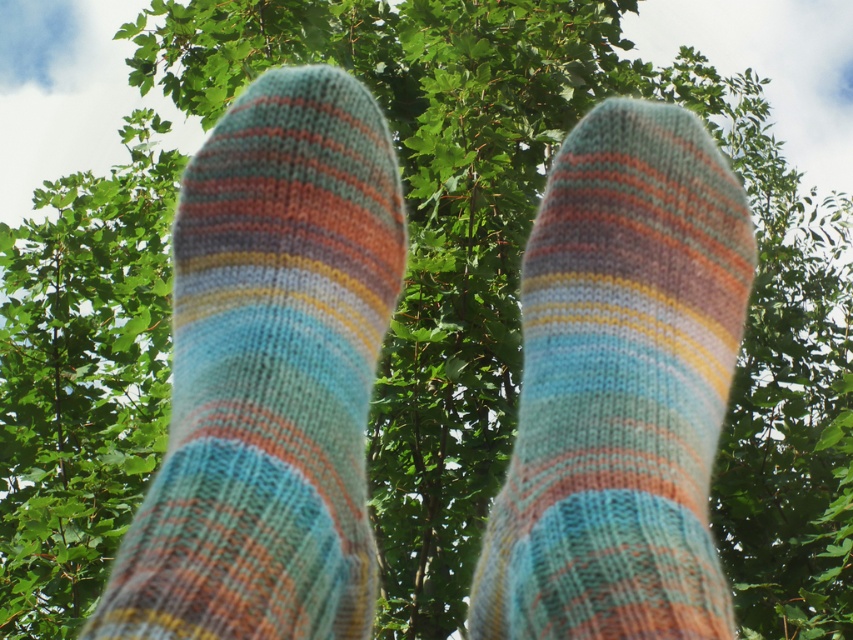
You are a tailor measuring two woolen socks for a client. The client needs to know if the distance between the striped woolen sock at center and the knitted woolen sock at center is sufficient to place a 20 cm ruler between them. Based on the image, can the ruler fit between them?

The striped woolen sock at center is 18.90 centimeters from the knitted woolen sock at center. Since the ruler is 20 cm long, it cannot fit between them as the distance is shorter than the ruler.

You are trying to decide which sock to wear for a casual day out. Both the striped woolen sock at center and the knitted woolen sock at center are options. Based on their thickness, which one might be more comfortable for walking long distances?

The knitted woolen sock at center is thicker than the striped woolen sock at center, so it might provide better cushioning and be more comfortable for walking long distances.

You are trying to decide which sock to wear today. You have a striped woolen sock at center and a knitted woolen sock at center. Which one is smaller in size?

The striped woolen sock at center is smaller in size compared to the knitted woolen sock at center.